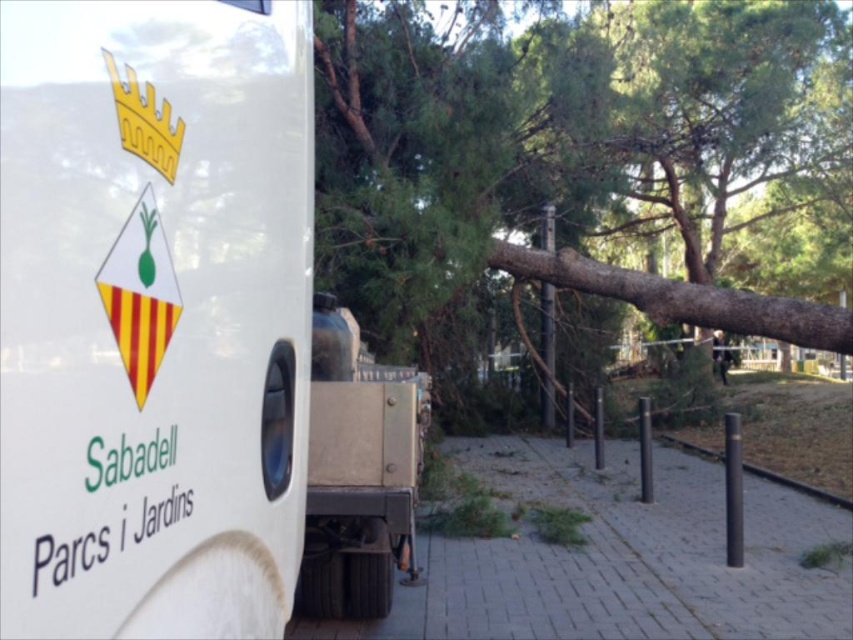
Does point (318, 532) come closer to viewer compared to point (680, 305)?

Yes, it is.

Between point (234, 205) and point (444, 92), which one is positioned in front?

Point (234, 205) is more forward.

Which is in front, point (228, 492) or point (344, 227)?

Point (228, 492) is more forward.

Image resolution: width=853 pixels, height=640 pixels. What are the coordinates of `white matte truck at center` in the screenshot? It's located at (183, 337).

Between white matte truck at center and metallic silver truck at center, which one is positioned lower?

metallic silver truck at center is lower down.

Between point (80, 611) and point (303, 596), which one is positioned in front?

Point (80, 611) is more forward.

Where is `white matte truck at center`? white matte truck at center is located at coordinates (183, 337).

Locate an element on the screen. brown rough wood at center is located at coordinates (555, 150).

Does point (590, 24) come behind point (416, 493)?

Yes.

Which is behind, point (753, 120) or point (381, 600)?

The point (753, 120) is behind.

At what (x,y) coordinates should I click in order to perform the action: click on brown rough wood at center. Please return your answer as a coordinate pair (x, y). This screenshot has width=853, height=640. Looking at the image, I should click on coord(555,150).